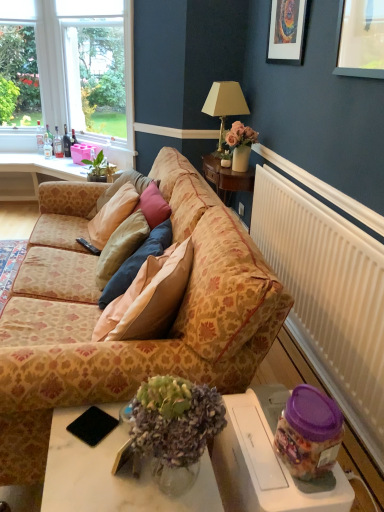
Question: Can you confirm if clear glass window at upper left is shorter than beige fabric lampshade at upper right?

Choices:
 (A) yes
 (B) no

Answer: (B)

Question: Are clear glass window at upper left and beige fabric lampshade at upper right beside each other?

Choices:
 (A) yes
 (B) no

Answer: (B)

Question: Can you confirm if clear glass window at upper left is taller than beige fabric lampshade at upper right?

Choices:
 (A) yes
 (B) no

Answer: (A)

Question: Is clear glass window at upper left not near beige fabric lampshade at upper right?

Choices:
 (A) yes
 (B) no

Answer: (A)

Question: Could beige fabric lampshade at upper right be considered to be inside clear glass window at upper left?

Choices:
 (A) no
 (B) yes

Answer: (A)

Question: From a real-world perspective, is clear glass window at upper left physically below beige fabric lampshade at upper right?

Choices:
 (A) yes
 (B) no

Answer: (B)

Question: From a real-world perspective, is clear glass bottle at upper left, the 4th bottle viewed from the right, physically above matte black picture frame at upper center?

Choices:
 (A) no
 (B) yes

Answer: (A)

Question: Does clear glass bottle at upper left, the 4th bottle viewed from the right, contain matte black picture frame at upper center?

Choices:
 (A) no
 (B) yes

Answer: (A)

Question: Is clear glass bottle at upper left, the 4th bottle viewed from the right, positioned behind matte black picture frame at upper center?

Choices:
 (A) no
 (B) yes

Answer: (B)

Question: Is clear glass bottle at upper left, arranged as the first bottle when viewed from the left, thinner than matte black picture frame at upper center?

Choices:
 (A) yes
 (B) no

Answer: (B)

Question: Can you confirm if clear glass bottle at upper left, the 4th bottle viewed from the right, is positioned to the right of matte black picture frame at upper center?

Choices:
 (A) yes
 (B) no

Answer: (B)

Question: From the image's perspective, would you say clear glass bottle at upper left, the 4th bottle viewed from the right, is shown under matte black picture frame at upper center?

Choices:
 (A) no
 (B) yes

Answer: (B)

Question: Considering the relative sizes of matte glass bottle at center, placed as the 4th bottle when sorted from left to right, and purple plastic jar at lower right in the image provided, is matte glass bottle at center, placed as the 4th bottle when sorted from left to right, shorter than purple plastic jar at lower right?

Choices:
 (A) yes
 (B) no

Answer: (A)